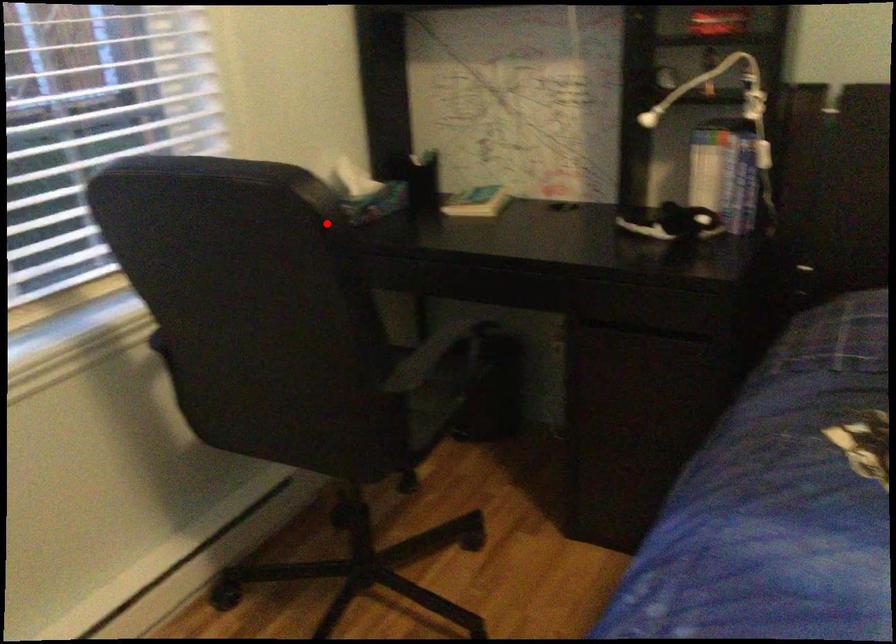
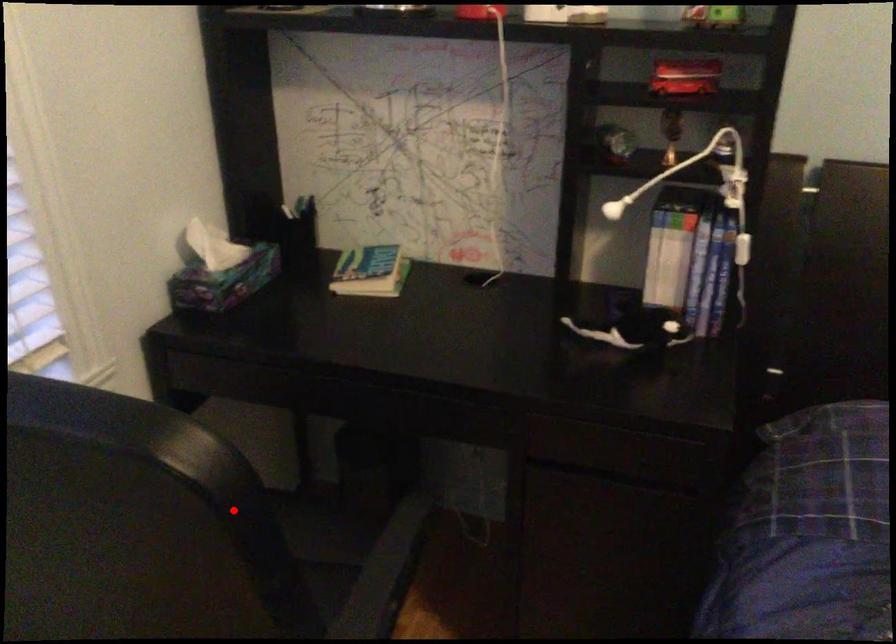
I am providing you with two images of the same scene from different viewpoints. A red point is marked on the first image and another point is marked on the second image. Is the marked point in image1 the same physical position as the marked point in image2?

Yes